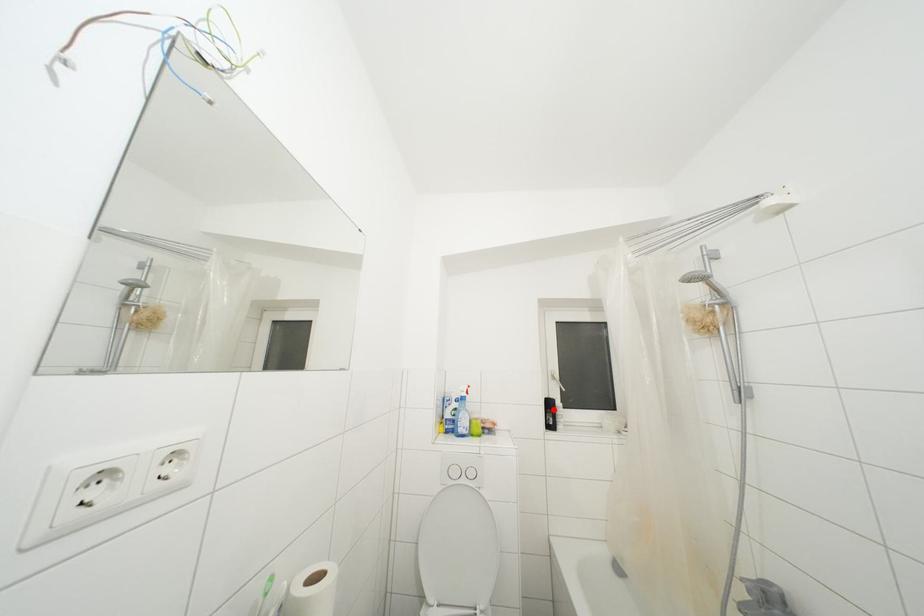
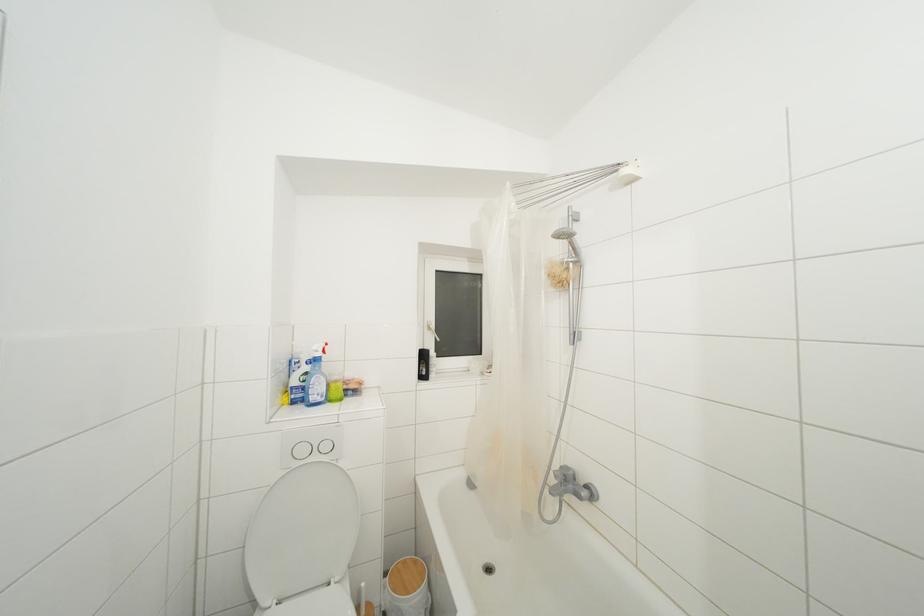
Question: I am providing you with two images of the same scene from different viewpoints. In image1, a red point is highlighted. Considering the same 3D point in image2, which of the following is correct?

Choices:
 (A) It is closer
 (B) It is farther

Answer: (A)